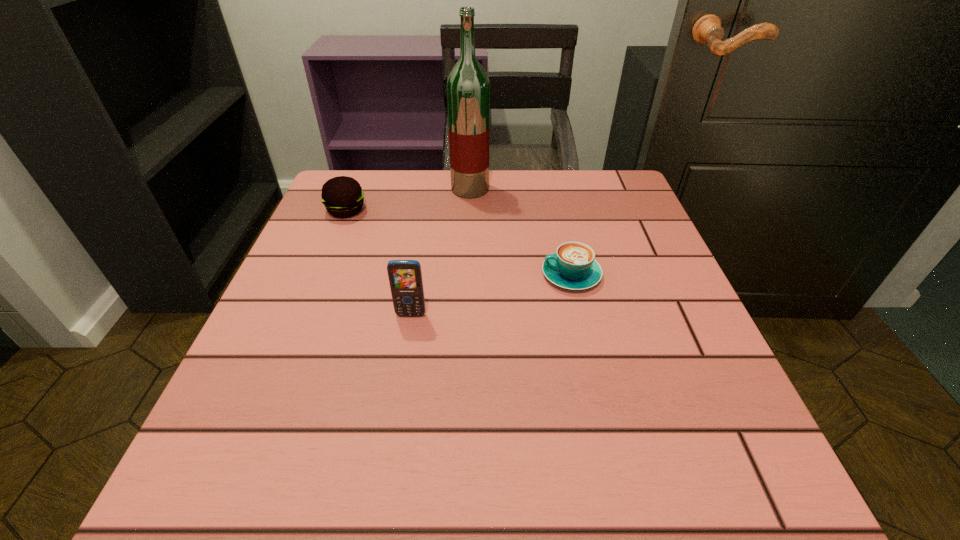
This screenshot has height=540, width=960. What are the coordinates of `empty space that is in between the third tallest object and the shortest object` in the screenshot? It's located at (459, 242).

At what (x,y) coordinates should I click in order to perform the action: click on free space between the third shortest object and the third object from left to right. Please return your answer as a coordinate pair (x, y). The width and height of the screenshot is (960, 540). Looking at the image, I should click on (441, 252).

This screenshot has height=540, width=960. What are the coordinates of `vacant space in between the farthest object and the cellular telephone` in the screenshot? It's located at (441, 252).

You are a GUI agent. You are given a task and a screenshot of the screen. Output one action in this format:
    pyautogui.click(x=<x>, y=<y>)
    Task: Click on the unoccupied area between the leftmost object and the rightmost object
    This screenshot has height=540, width=960.
    Given the screenshot: What is the action you would take?
    pyautogui.click(x=459, y=242)

At what (x,y) coordinates should I click in order to perform the action: click on free area in between the tallest object and the second farthest object. Please return your answer as a coordinate pair (x, y). Looking at the image, I should click on (408, 200).

Identify which object is the nearest to the second object from left to right. Please provide its 2D coordinates. Your answer should be formatted as a tuple, i.e. [(x, y)], where the tuple contains the x and y coordinates of a point satisfying the conditions above.

[(573, 266)]

In order to click on object that stands as the closest to the leftmost object in this screenshot , I will do `click(468, 87)`.

The height and width of the screenshot is (540, 960). What are the coordinates of `vacant region that satisfies the following two spatial constraints: 1. with the handle on the right side of the rightmost object; 2. on the screen of the second object from left to right` in the screenshot? It's located at (581, 315).